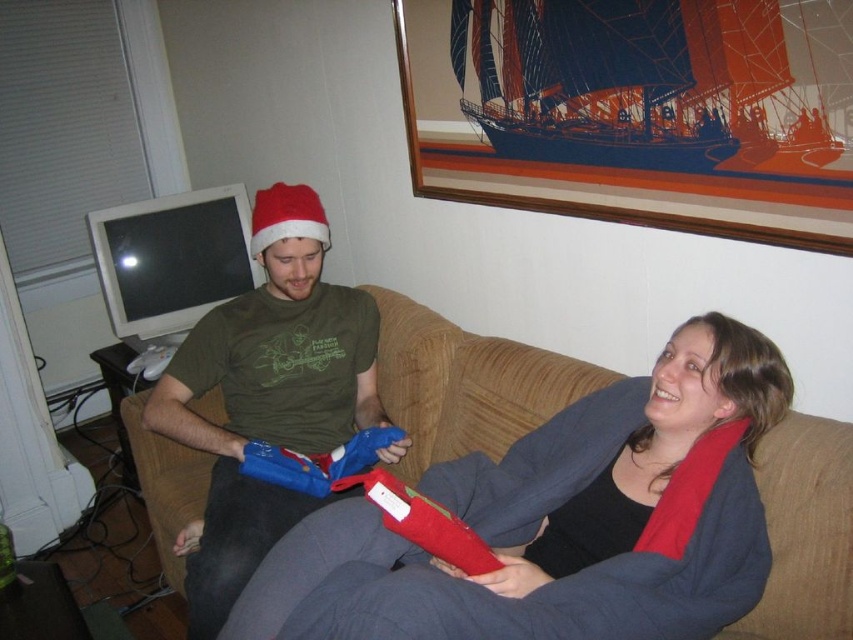
Which is in front, point (457, 188) or point (445, 451)?

Positioned in front is point (445, 451).

Measure the distance between wooden picture frame at upper right and brown fabric couch at center.

wooden picture frame at upper right is 22.74 inches away from brown fabric couch at center.

Between point (778, 68) and point (833, 420), which one is positioned behind?

Point (833, 420)

Locate an element on the screen. wooden picture frame at upper right is located at coordinates (634, 112).

Is wooden picture frame at upper right shorter than matte green t-shirt at center?

Indeed, wooden picture frame at upper right has a lesser height compared to matte green t-shirt at center.

Does point (585, 116) come closer to viewer compared to point (242, 548)?

No, it is not.

Locate an element on the screen. This screenshot has width=853, height=640. wooden picture frame at upper right is located at coordinates (634, 112).

Can you confirm if matte green t-shirt at center is taller than brown fabric couch at center?

Yes.

Between matte green t-shirt at center and brown fabric couch at center, which one appears on the left side from the viewer's perspective?

Positioned to the left is matte green t-shirt at center.

Measure the distance between matte green t-shirt at center and camera.

5.07 feet

Locate an element on the screen. matte green t-shirt at center is located at coordinates (265, 394).